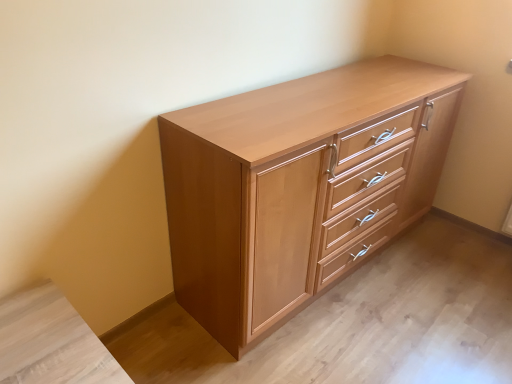
Question: Considering the positions of light brown wood chest of drawers at center and light brown wood vanity at lower left in the image, is light brown wood chest of drawers at center wider or thinner than light brown wood vanity at lower left?

Choices:
 (A) wide
 (B) thin

Answer: (A)

Question: Is point (369, 175) positioned closer to the camera than point (103, 350)?

Choices:
 (A) farther
 (B) closer

Answer: (A)

Question: From a real-world perspective, relative to light brown wood vanity at lower left, is light brown wood chest of drawers at center vertically above or below?

Choices:
 (A) above
 (B) below

Answer: (A)

Question: From their relative heights in the image, would you say light brown wood vanity at lower left is taller or shorter than light brown wood chest of drawers at center?

Choices:
 (A) short
 (B) tall

Answer: (A)

Question: Considering the positions of point (112, 372) and point (240, 271), is point (112, 372) closer or farther from the camera than point (240, 271)?

Choices:
 (A) farther
 (B) closer

Answer: (B)

Question: From the image's perspective, is light brown wood vanity at lower left above or below light brown wood chest of drawers at center?

Choices:
 (A) above
 (B) below

Answer: (B)

Question: Is light brown wood vanity at lower left inside the boundaries of light brown wood chest of drawers at center, or outside?

Choices:
 (A) outside
 (B) inside

Answer: (A)